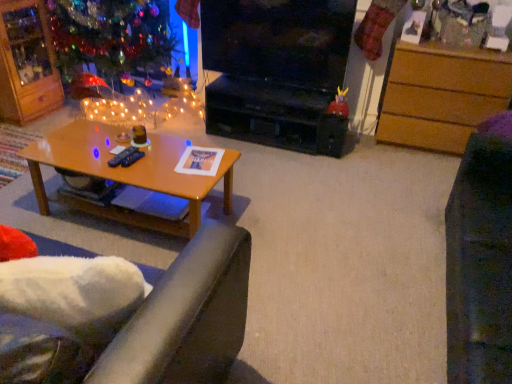
Question: From the image's perspective, is wooden drawer at right located above black glossy television at center?

Choices:
 (A) no
 (B) yes

Answer: (A)

Question: Can black glossy television at center be found inside wooden drawer at right?

Choices:
 (A) yes
 (B) no

Answer: (B)

Question: Does wooden drawer at right have a larger size compared to black glossy television at center?

Choices:
 (A) yes
 (B) no

Answer: (A)

Question: Can you confirm if wooden drawer at right is thinner than black glossy television at center?

Choices:
 (A) no
 (B) yes

Answer: (A)

Question: Is wooden drawer at right wider than black glossy television at center?

Choices:
 (A) yes
 (B) no

Answer: (A)

Question: From a real-world perspective, is shiny glass christmas tree at upper left positioned above or below shiny red toy at center?

Choices:
 (A) above
 (B) below

Answer: (A)

Question: In the image, is shiny glass christmas tree at upper left on the left side or the right side of shiny red toy at center?

Choices:
 (A) right
 (B) left

Answer: (B)

Question: Looking at their shapes, would you say shiny glass christmas tree at upper left is wider or thinner than shiny red toy at center?

Choices:
 (A) thin
 (B) wide

Answer: (B)

Question: Considering the positions of shiny glass christmas tree at upper left and shiny red toy at center in the image, is shiny glass christmas tree at upper left bigger or smaller than shiny red toy at center?

Choices:
 (A) small
 (B) big

Answer: (B)

Question: From a real-world perspective, is black glossy television at center physically located above or below black matte entertainment center at center?

Choices:
 (A) below
 (B) above

Answer: (B)

Question: In the image, is black glossy television at center positioned in front of or behind black matte entertainment center at center?

Choices:
 (A) front
 (B) behind

Answer: (A)

Question: Considering the positions of black glossy television at center and black matte entertainment center at center in the image, is black glossy television at center wider or thinner than black matte entertainment center at center?

Choices:
 (A) wide
 (B) thin

Answer: (B)

Question: From the image's perspective, relative to black matte entertainment center at center, is black glossy television at center above or below?

Choices:
 (A) below
 (B) above

Answer: (B)

Question: Is satin blue remote control at center, which is the 1th remote control from left to right, taller or shorter than wooden drawer at right?

Choices:
 (A) short
 (B) tall

Answer: (A)

Question: From the image's perspective, is satin blue remote control at center, which is counted as the second remote control, starting from the right, above or below wooden drawer at right?

Choices:
 (A) above
 (B) below

Answer: (B)